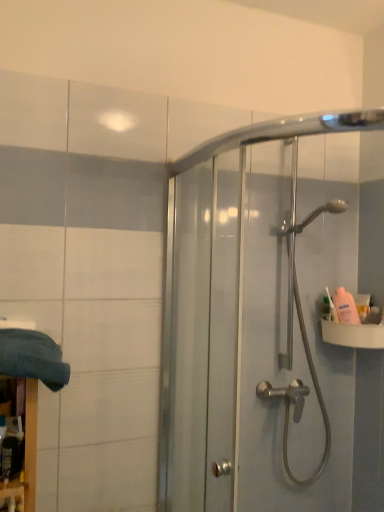
This screenshot has width=384, height=512. Describe the element at coordinates (33, 357) in the screenshot. I see `dark blue fabric at lower left` at that location.

What is the approximate height of clear glass shower door at upper right?

clear glass shower door at upper right is 1.07 meters tall.

What do you see at coordinates (259, 321) in the screenshot? Image resolution: width=384 pixels, height=512 pixels. I see `clear glass shower door at upper right` at bounding box center [259, 321].

I want to click on white plastic sink at right, so (x=353, y=334).

The image size is (384, 512). In order to click on dark blue fabric at lower left in this screenshot , I will do `click(33, 357)`.

What's the angular difference between pink plastic bottle at right and dark blue fabric at lower left's facing directions?

The angular difference between pink plastic bottle at right and dark blue fabric at lower left is 54.4 degrees.

Is pink plastic bottle at right not inside dark blue fabric at lower left?

Yes, pink plastic bottle at right is located beyond the bounds of dark blue fabric at lower left.

Are pink plastic bottle at right and dark blue fabric at lower left making contact?

pink plastic bottle at right and dark blue fabric at lower left are not in contact.

What's the angular difference between white plastic sink at right and dark blue fabric at lower left's facing directions?

They differ by 50.1 degrees in their facing directions.

From the image's perspective, between white plastic sink at right and dark blue fabric at lower left, who is located below?

white plastic sink at right.

Is white plastic sink at right in contact with dark blue fabric at lower left?

No, white plastic sink at right is not making contact with dark blue fabric at lower left.

Is clear glass shower door at upper right oriented towards white plastic sink at right?

No, clear glass shower door at upper right is not facing towards white plastic sink at right.

This screenshot has height=512, width=384. I want to click on screen door above the white plastic sink at right (from a real-world perspective), so click(259, 321).

Which is behind, point (245, 142) or point (365, 342)?

The point (365, 342) is more distant.

From the image's perspective, is clear glass shower door at upper right beneath white plastic sink at right?

Incorrect, from the image's perspective, clear glass shower door at upper right is higher than white plastic sink at right.

Between pink plastic bottle at right and clear glass shower door at upper right, which one has larger size?

clear glass shower door at upper right.

Based on the photo, from the image's perspective, relative to clear glass shower door at upper right, is pink plastic bottle at right above or below?

pink plastic bottle at right is below clear glass shower door at upper right.

Locate an element on the screen. The image size is (384, 512). toiletry lying behind the clear glass shower door at upper right is located at coordinates (332, 307).

Is dark blue fabric at lower left facing away from clear glass shower door at upper right?

No, clear glass shower door at upper right is not at the back of dark blue fabric at lower left.

From the image's perspective, between dark blue fabric at lower left and clear glass shower door at upper right, who is located below?

dark blue fabric at lower left, from the image's perspective.

Can you confirm if dark blue fabric at lower left is bigger than clear glass shower door at upper right?

Actually, dark blue fabric at lower left might be smaller than clear glass shower door at upper right.

Considering the sizes of objects dark blue fabric at lower left and white plastic sink at right in the image provided, who is thinner, dark blue fabric at lower left or white plastic sink at right?

white plastic sink at right.

From a real-world perspective, is dark blue fabric at lower left on top of white plastic sink at right?

No.

Do you think dark blue fabric at lower left is within white plastic sink at right, or outside of it?

dark blue fabric at lower left is not enclosed by white plastic sink at right.

Is point (56, 389) less distant than point (345, 327)?

Yes, it is.

Between white plastic sink at right and clear glass shower door at upper right, which one is positioned behind?

white plastic sink at right is further from the camera.

Does white plastic sink at right contain clear glass shower door at upper right?

No, clear glass shower door at upper right is not surrounded by white plastic sink at right.

Is white plastic sink at right at the right side of clear glass shower door at upper right?

Indeed, white plastic sink at right is positioned on the right side of clear glass shower door at upper right.

Identify the location of toiletry above the dark blue fabric at lower left (from a real-world perspective). The image size is (384, 512). (332, 307).

This screenshot has height=512, width=384. I want to click on bath towel located in front of the white plastic sink at right, so click(x=33, y=357).

From the image, which object appears to be nearer to white plastic sink at right, clear glass shower door at upper right or dark blue fabric at lower left?

Based on the image, clear glass shower door at upper right appears to be nearer to white plastic sink at right.

Estimate the real-world distances between objects in this image. Which object is further from white plastic sink at right, dark blue fabric at lower left or pink plastic bottle at right?

The object further to white plastic sink at right is dark blue fabric at lower left.

Considering their positions, is white plastic sink at right positioned closer to clear glass shower door at upper right than dark blue fabric at lower left?

Based on the image, white plastic sink at right appears to be nearer to clear glass shower door at upper right.

Which object lies further to the anchor point dark blue fabric at lower left, white plastic sink at right or pink plastic bottle at right?

pink plastic bottle at right.

Considering their positions, is clear glass shower door at upper right positioned further to dark blue fabric at lower left than pink plastic bottle at right?

pink plastic bottle at right is positioned further to the anchor dark blue fabric at lower left.

Based on their spatial positions, is white plastic sink at right or clear glass shower door at upper right closer to dark blue fabric at lower left?

clear glass shower door at upper right is closer to dark blue fabric at lower left.

Looking at the image, which one is located closer to dark blue fabric at lower left, clear glass shower door at upper right or white plastic sink at right?

clear glass shower door at upper right is positioned closer to the anchor dark blue fabric at lower left.

Looking at the image, which one is located further to white plastic sink at right, dark blue fabric at lower left or clear glass shower door at upper right?

dark blue fabric at lower left lies further to white plastic sink at right than the other object.

This screenshot has width=384, height=512. I want to click on sink positioned between clear glass shower door at upper right and pink plastic bottle at right from near to far, so click(353, 334).

At what (x,y) coordinates should I click in order to perform the action: click on screen door between dark blue fabric at lower left and pink plastic bottle at right from left to right. Please return your answer as a coordinate pair (x, y). The width and height of the screenshot is (384, 512). Looking at the image, I should click on (259, 321).

Find the location of a particular element. This screenshot has height=512, width=384. screen door between dark blue fabric at lower left and white plastic sink at right from left to right is located at coordinates (259, 321).

Find the location of a particular element. toiletry between dark blue fabric at lower left and white plastic sink at right in the horizontal direction is located at coordinates (332, 307).